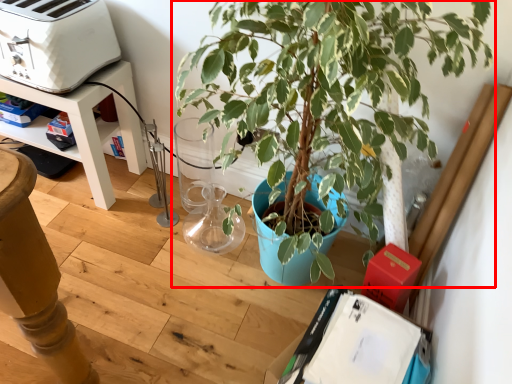
Question: Observing the image, what is the correct spatial positioning of houseplant (annotated by the red box) in reference to appliance?

Choices:
 (A) right
 (B) left

Answer: (A)